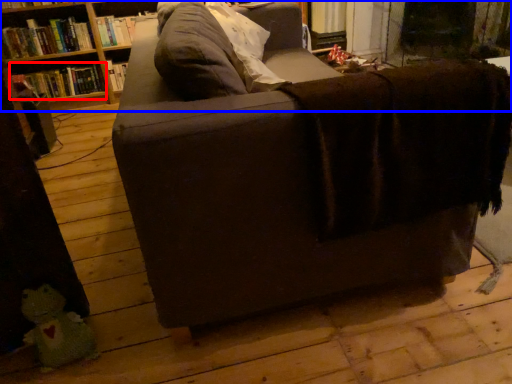
Question: Which object appears closest to the camera in this image, book (highlighted by a red box) or shelf (highlighted by a blue box)?

Choices:
 (A) book
 (B) shelf

Answer: (B)